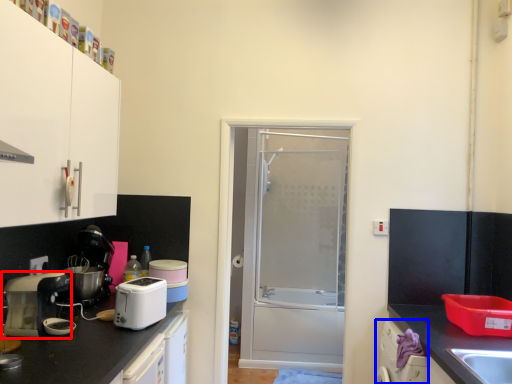
Question: Which point is further to the camera, home appliance (highlighted by a red box) or dish washer (highlighted by a blue box)?

Choices:
 (A) home appliance
 (B) dish washer

Answer: (B)